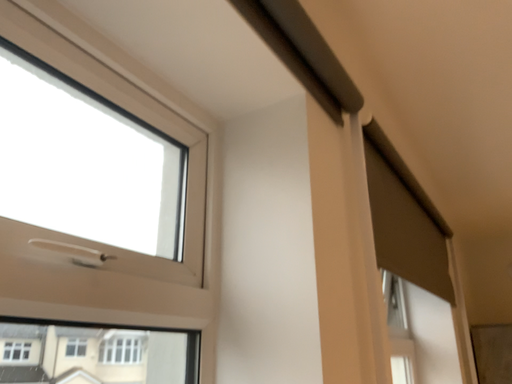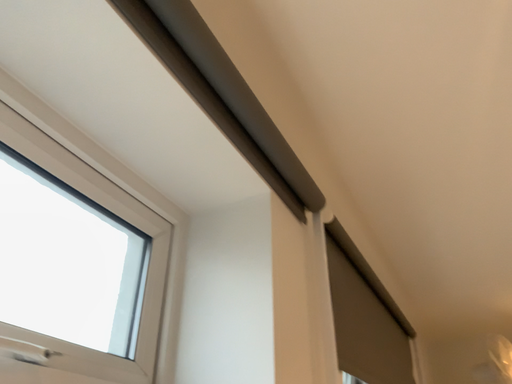
Question: How did the camera likely rotate when shooting the video?

Choices:
 (A) rotated upward
 (B) rotated downward

Answer: (A)